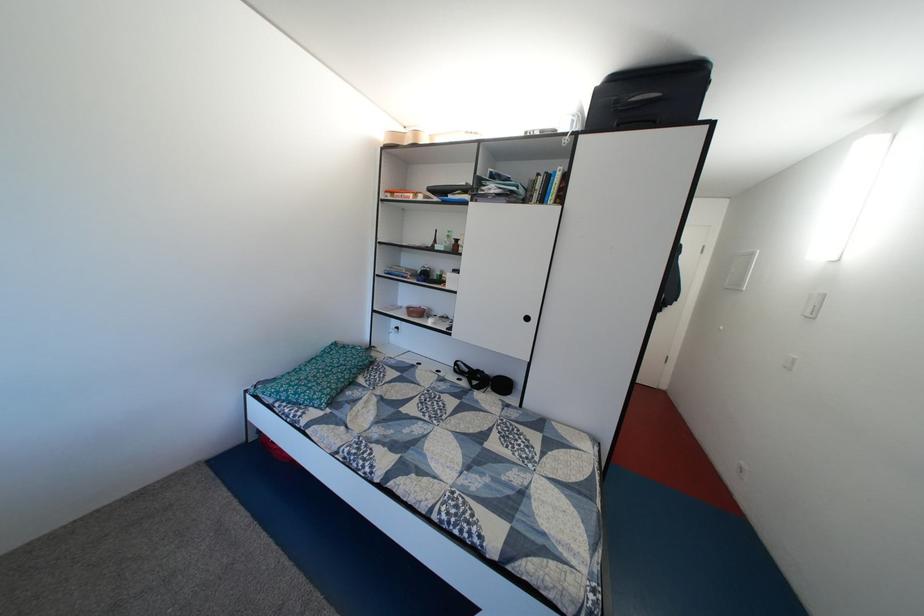
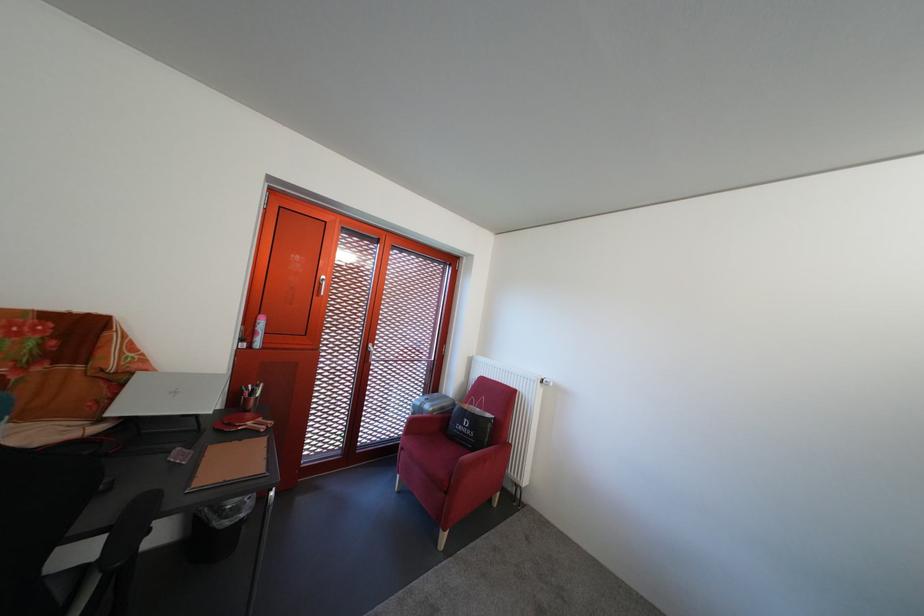
Question: How did the camera likely rotate?

Choices:
 (A) Left
 (B) Right
 (C) Up
 (D) Down

Answer: (A)